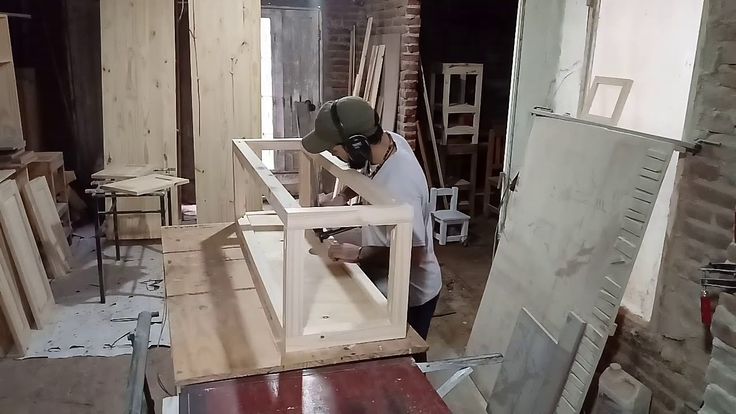
Image resolution: width=736 pixels, height=414 pixels. I want to click on metal legs, so click(x=112, y=226), click(x=160, y=220), click(x=166, y=219), click(x=96, y=258).